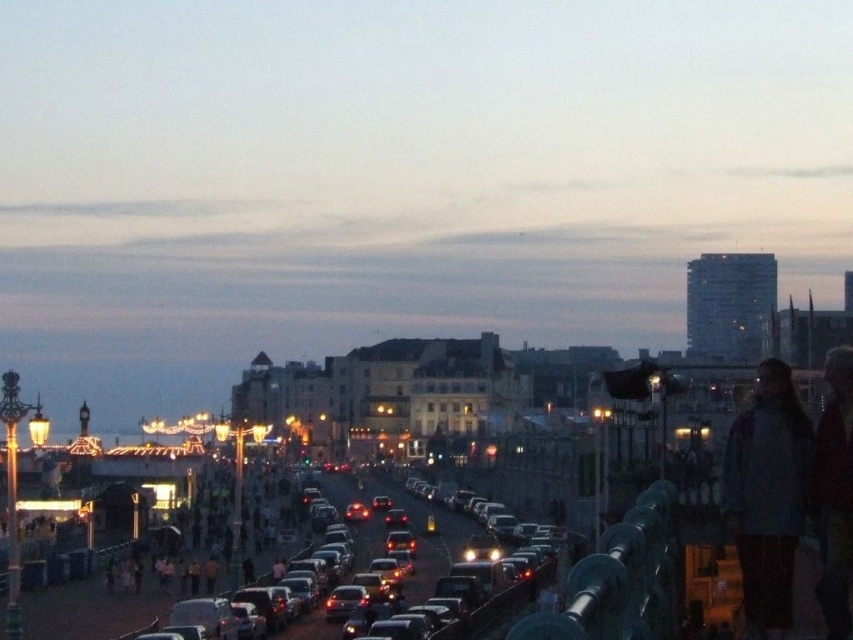
Who is positioned more to the right, light gray sweater at right or shiny silver car at center?

From the viewer's perspective, light gray sweater at right appears more on the right side.

Which is behind, point (786, 609) or point (347, 573)?

Positioned behind is point (347, 573).

In order to click on light gray sweater at right in this screenshot , I will do `click(767, 496)`.